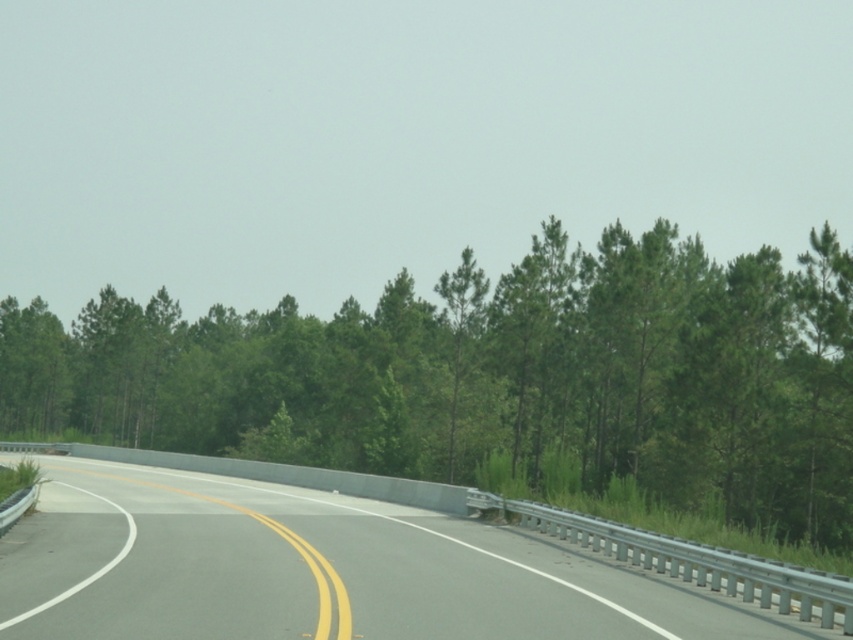
You are driving a car and want to know if the green leafy tree at center is closer to you than the gray asphalt highway at center. Based on the scene, can you determine which is closer?

The green leafy tree at center is closer to you than the gray asphalt highway at center because it is positioned further to the viewer in the scene.

You are driving a car and see two points on the road ahead. One is at point (38, 353) and the other at point (247, 547). Which point is farther away from your current position?

Point (38, 353) is behind point (247, 547), so it is farther away from your current position.